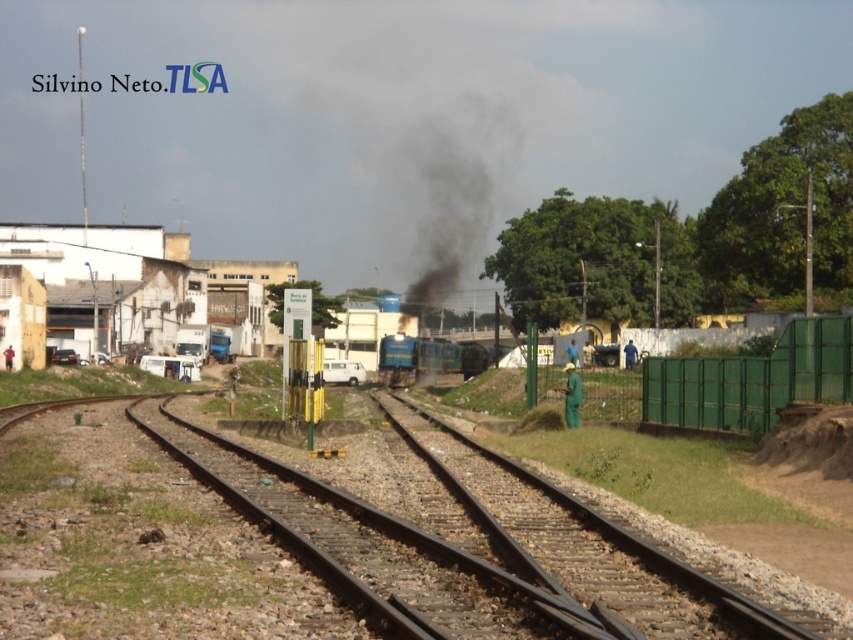
Consider the image. You are standing at the edge of the railway tracks and see the metal train tracks at center and the blue metallic train at center. Which object is closer to you?

The metal train tracks at center are closer to the viewer than the blue metallic train at center.

You are a railway inspector checking the tracks. You notice the metal train tracks at center and the brown gravel train track at center. Which one is located to the left when facing the direction the train is moving?

The metal train tracks at center is positioned on the left side of brown gravel train track at center, so when facing the direction the train is moving, the metal train tracks at center would be on the left.

You are a photographer standing at the edge of the railway. You want to take a photo of the metal train tracks at center and the blue metallic train at center. Which object will appear smaller in the photo?

The metal train tracks at center will appear smaller in the photo because it is shorter than the blue metallic train at center.